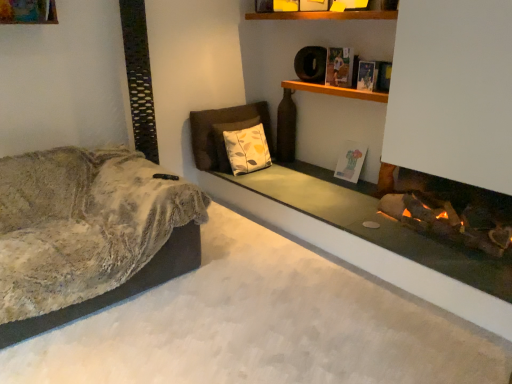
Question: Is hardcover book at upper center, which appears as the second book when viewed from the back, a part of smooth concrete fireplace at lower right?

Choices:
 (A) yes
 (B) no

Answer: (B)

Question: From the image's perspective, is smooth concrete fireplace at lower right above hardcover book at upper center, which ranks as the first book in top-to-bottom order?

Choices:
 (A) yes
 (B) no

Answer: (B)

Question: Considering the relative sizes of smooth concrete fireplace at lower right and hardcover book at upper center, the 3th book from the bottom, in the image provided, is smooth concrete fireplace at lower right thinner than hardcover book at upper center, the 3th book from the bottom,?

Choices:
 (A) no
 (B) yes

Answer: (A)

Question: Does smooth concrete fireplace at lower right have a larger size compared to hardcover book at upper center, the 3th book from the bottom?

Choices:
 (A) no
 (B) yes

Answer: (B)

Question: Is hardcover book at upper center, which appears as the second book when viewed from the front, at the back of smooth concrete fireplace at lower right?

Choices:
 (A) no
 (B) yes

Answer: (A)

Question: In terms of width, does hardcover book at upper right, the 1th book when ordered from front to back, look wider or thinner when compared to floral-patterned fabric pillow at center?

Choices:
 (A) thin
 (B) wide

Answer: (A)

Question: Is hardcover book at upper right, the 2th book when ordered from bottom to top, in front of or behind floral-patterned fabric pillow at center in the image?

Choices:
 (A) front
 (B) behind

Answer: (A)

Question: From a real-world perspective, relative to floral-patterned fabric pillow at center, is hardcover book at upper right, arranged as the third book when viewed from the back, vertically above or below?

Choices:
 (A) above
 (B) below

Answer: (A)

Question: Is point (371, 89) positioned closer to the camera than point (260, 142)?

Choices:
 (A) closer
 (B) farther

Answer: (A)

Question: From their relative heights in the image, would you say matte white book at center, positioned as the 3th book in front-to-back order, is taller or shorter than fuzzy beige couch at left?

Choices:
 (A) short
 (B) tall

Answer: (A)

Question: Based on their positions, is matte white book at center, which ranks as the 3th book in top-to-bottom order, located to the left or right of fuzzy beige couch at left?

Choices:
 (A) right
 (B) left

Answer: (A)

Question: Which is correct: matte white book at center, the first book when ordered from back to front, is inside fuzzy beige couch at left, or outside of it?

Choices:
 (A) outside
 (B) inside

Answer: (A)

Question: Based on their sizes in the image, would you say matte white book at center, which ranks as the 3th book in top-to-bottom order, is bigger or smaller than fuzzy beige couch at left?

Choices:
 (A) big
 (B) small

Answer: (B)

Question: From their relative heights in the image, would you say hardcover book at upper right, arranged as the third book when viewed from the back, is taller or shorter than matte white book at center, positioned as the 3th book in front-to-back order?

Choices:
 (A) short
 (B) tall

Answer: (A)

Question: Visually, is hardcover book at upper right, arranged as the third book when viewed from the back, positioned to the left or to the right of matte white book at center, arranged as the 1th book when ordered from the bottom?

Choices:
 (A) left
 (B) right

Answer: (B)